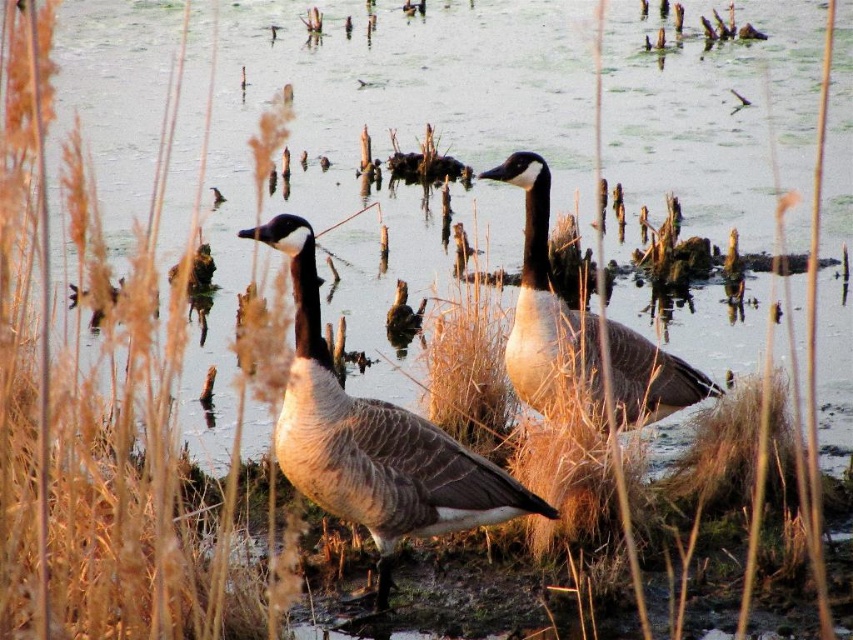
You are a photographer trying to capture the matte gray duck at center and the brown grass at left in your shot. Which object is larger in the frame?

The brown grass at left is bigger than the matte gray duck at center, so the brown grass at left will appear larger in the frame.

You are a photographer aiming to capture a clear shot of the matte gray duck at center without the brown grass at left obstructing it. Based on their positions, is this possible?

The brown grass at left is in front of the matte gray duck at center, so it will block the view. Move your position to the right or left to avoid the grass.